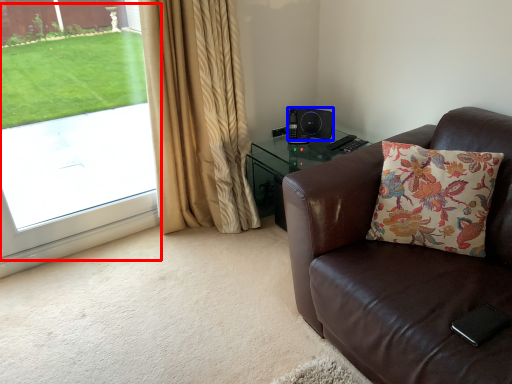
Question: Which object appears farthest to the camera in this image, window screen (highlighted by a red box) or speaker (highlighted by a blue box)?

Choices:
 (A) window screen
 (B) speaker

Answer: (B)